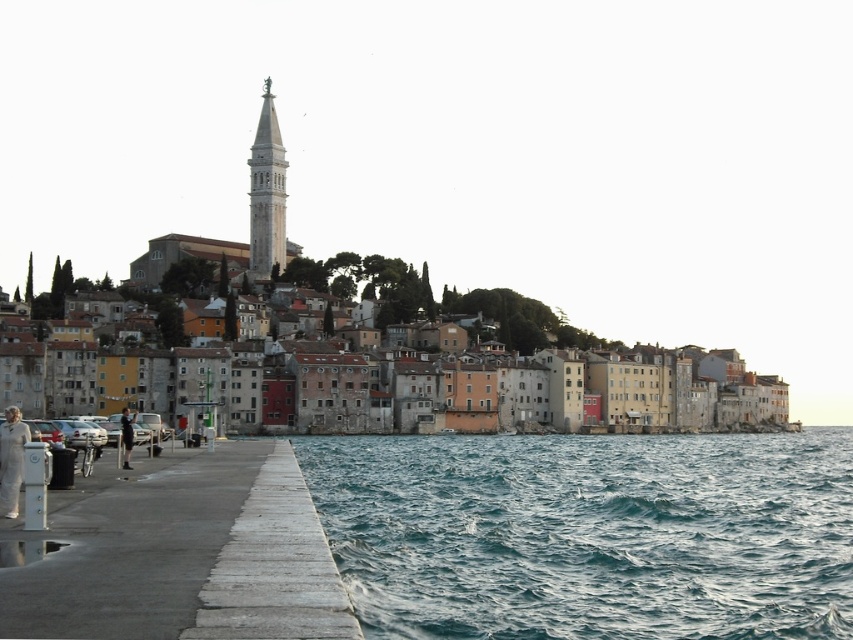
Can you confirm if teal water at lower right is positioned above white concrete dock at lower left?

No.

Is point (590, 520) positioned after point (279, 460)?

No.

Where is `teal water at lower right`? This screenshot has width=853, height=640. teal water at lower right is located at coordinates (589, 532).

Is the position of teal water at lower right less distant than that of white stone tower at upper center?

Yes, teal water at lower right is closer to the viewer.

Who is positioned more to the right, teal water at lower right or white stone tower at upper center?

From the viewer's perspective, teal water at lower right appears more on the right side.

Between point (697, 516) and point (260, 154), which one is positioned behind?

The point (260, 154) is behind.

Locate an element on the screen. This screenshot has width=853, height=640. teal water at lower right is located at coordinates (589, 532).

Is multicolored stone buildings at center below white stone tower at upper center?

Indeed, multicolored stone buildings at center is positioned under white stone tower at upper center.

Is multicolored stone buildings at center further to camera compared to white stone tower at upper center?

No, multicolored stone buildings at center is closer to the viewer.

Is point (186, 278) positioned after point (271, 193)?

No, it is in front of (271, 193).

Identify the location of multicolored stone buildings at center. (436, 301).